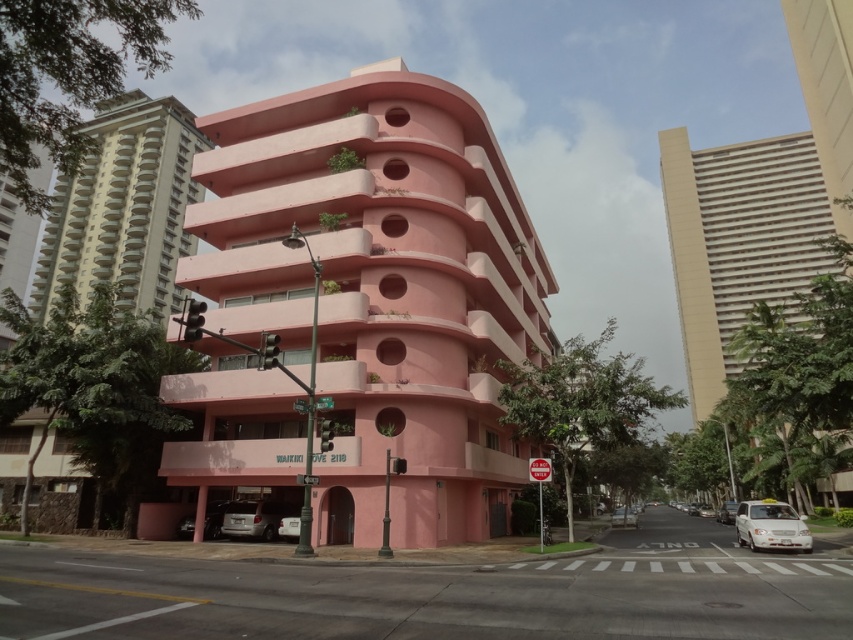
Can you confirm if pink matte building at center is smaller than metallic silver car at lower left?

Actually, pink matte building at center might be larger than metallic silver car at lower left.

Does pink matte building at center come in front of metallic silver car at lower left?

Yes, pink matte building at center is in front of metallic silver car at lower left.

Describe the element at coordinates (381, 289) in the screenshot. I see `pink matte building at center` at that location.

The image size is (853, 640). I want to click on pink matte building at center, so click(381, 289).

Who is positioned more to the left, pink matte building at center or silver metallic car at lower left?

From the viewer's perspective, silver metallic car at lower left appears more on the left side.

Where is `pink matte building at center`? pink matte building at center is located at coordinates (381, 289).

Image resolution: width=853 pixels, height=640 pixels. I want to click on pink matte building at center, so click(381, 289).

What do you see at coordinates (381, 289) in the screenshot?
I see `pink matte building at center` at bounding box center [381, 289].

Is point (265, 461) positioned after point (769, 506)?

Yes, point (265, 461) is farther from viewer.

At what (x,y) coordinates should I click in order to perform the action: click on pink matte building at center. Please return your answer as a coordinate pair (x, y). This screenshot has height=640, width=853. Looking at the image, I should click on (381, 289).